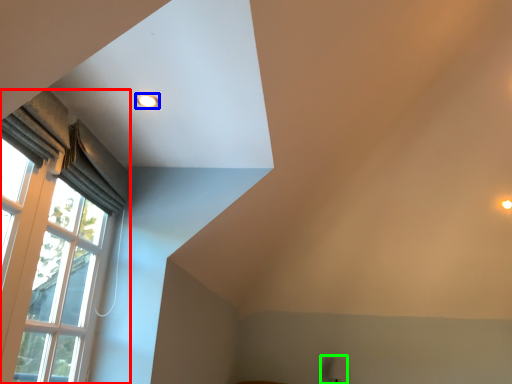
Question: Considering the real-world distances, which object is closest to window (highlighted by a red box)? lighting (highlighted by a blue box) or table lamp (highlighted by a green box).

Choices:
 (A) lighting
 (B) table lamp

Answer: (A)